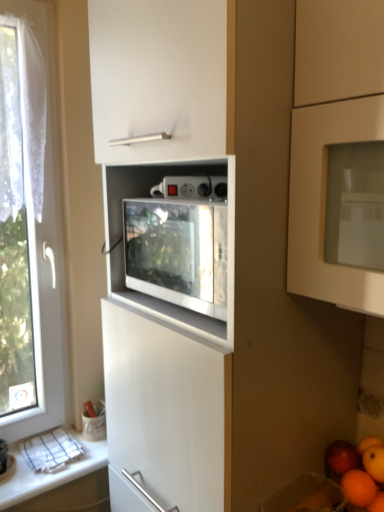
Question: Is red matte apple at lower right wider than orange matte at lower right, arranged as the 1th orange when viewed from the top?

Choices:
 (A) yes
 (B) no

Answer: (B)

Question: Are red matte apple at lower right and orange matte at lower right, arranged as the 1th orange when viewed from the top, located far from each other?

Choices:
 (A) no
 (B) yes

Answer: (A)

Question: Is red matte apple at lower right oriented towards orange matte at lower right, arranged as the 1th orange when viewed from the top?

Choices:
 (A) yes
 (B) no

Answer: (B)

Question: Is orange matte at lower right, positioned as the second orange in bottom-to-top order, surrounded by red matte apple at lower right?

Choices:
 (A) no
 (B) yes

Answer: (A)

Question: Is red matte apple at lower right to the left of orange matte at lower right, positioned as the second orange in bottom-to-top order, from the viewer's perspective?

Choices:
 (A) yes
 (B) no

Answer: (A)

Question: From the image's perspective, would you say red matte apple at lower right is shown under orange matte at lower right, arranged as the 1th orange when viewed from the top?

Choices:
 (A) yes
 (B) no

Answer: (A)

Question: From a real-world perspective, is red matte apple at lower right beneath smooth orange at lower right?

Choices:
 (A) yes
 (B) no

Answer: (B)

Question: Is red matte apple at lower right shorter than smooth orange at lower right?

Choices:
 (A) no
 (B) yes

Answer: (B)

Question: From the image's perspective, does red matte apple at lower right appear lower than smooth orange at lower right?

Choices:
 (A) no
 (B) yes

Answer: (A)

Question: From a real-world perspective, does red matte apple at lower right stand above smooth orange at lower right?

Choices:
 (A) yes
 (B) no

Answer: (A)

Question: Is the depth of red matte apple at lower right greater than that of smooth orange at lower right?

Choices:
 (A) no
 (B) yes

Answer: (B)

Question: Does red matte apple at lower right have a lesser width compared to smooth orange at lower right?

Choices:
 (A) no
 (B) yes

Answer: (B)

Question: Can you see orange matte at lower right, arranged as the 1th orange when viewed from the top, touching orange matte at lower right, which is the first orange from bottom to top?

Choices:
 (A) no
 (B) yes

Answer: (B)